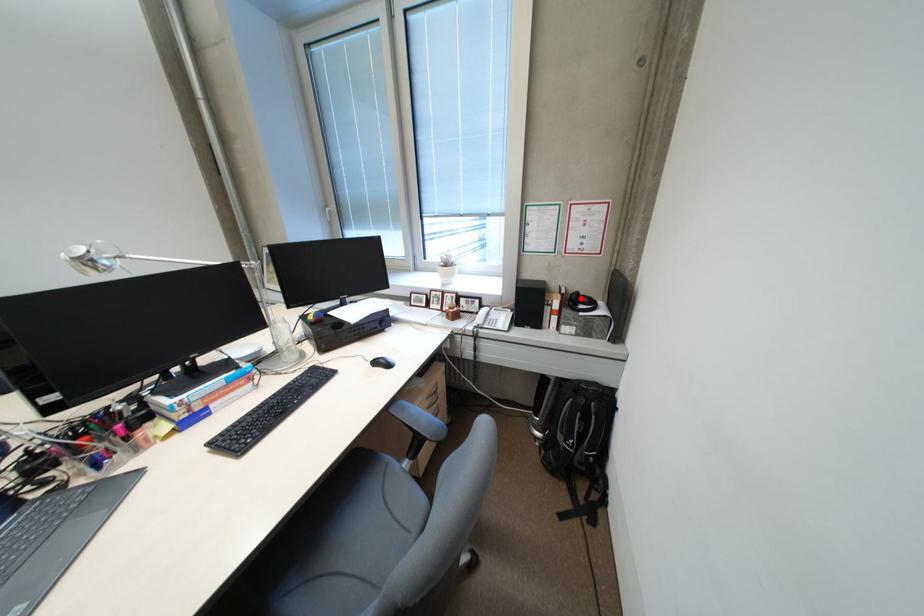
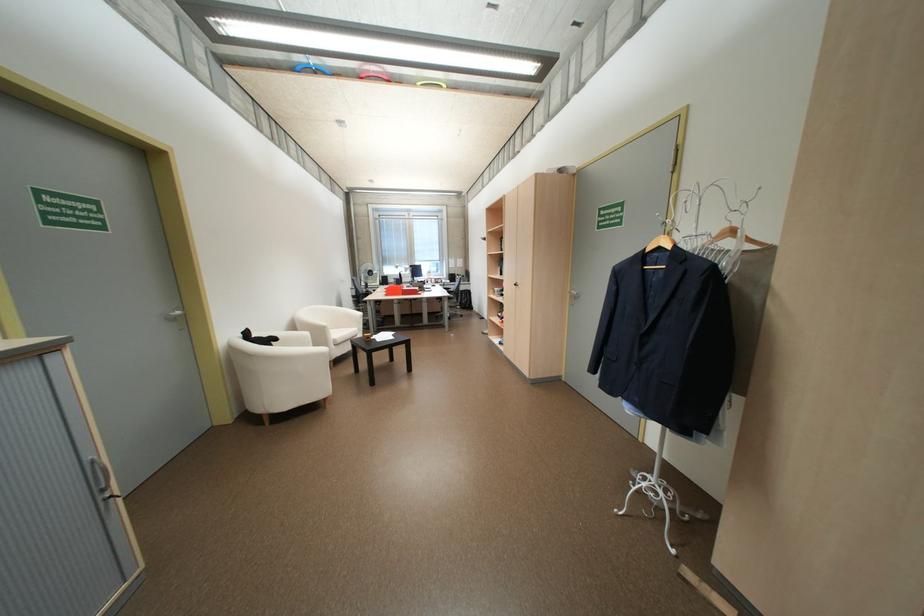
Question: I am providing you with two images of the same scene from different viewpoints. A red point is marked on the first image. Is the red point's position out of view in image 2?

Choices:
 (A) Yes
 (B) No

Answer: (A)